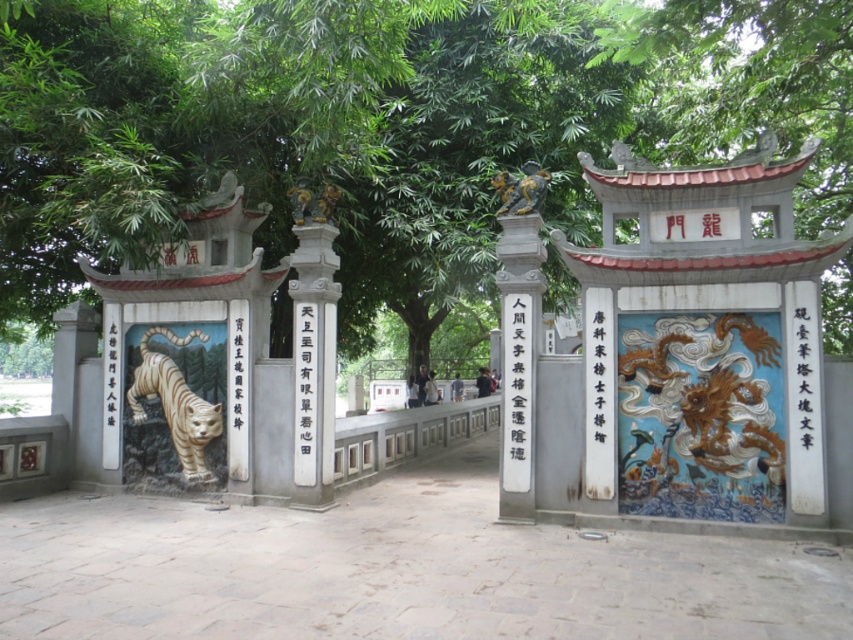
Question: Which point is farther to the camera?

Choices:
 (A) green leafy tree at center
 (B) white glossy tiger at left
 (C) white stone pillar at center

Answer: (B)

Question: Which point is closer to the camera?

Choices:
 (A) bronze statue at upper center
 (B) green leafy tree at center
 (C) white stone pillar at center
 (D) white glossy tiger at left

Answer: (B)

Question: From the image, what is the correct spatial relationship of green leafy tree at center in relation to white glossy tiger at left?

Choices:
 (A) below
 (B) above

Answer: (B)

Question: Can you confirm if white stone plaque at center is bigger than bronze statue at upper center?

Choices:
 (A) no
 (B) yes

Answer: (B)

Question: Among these objects, which one is farthest from the camera?

Choices:
 (A) green leafy tree at center
 (B) bronze statue at upper center
 (C) white glossy tiger at left
 (D) white stone pillar at center

Answer: (C)

Question: Does white glossy tiger at left have a lesser width compared to bronze statue at upper center?

Choices:
 (A) no
 (B) yes

Answer: (A)